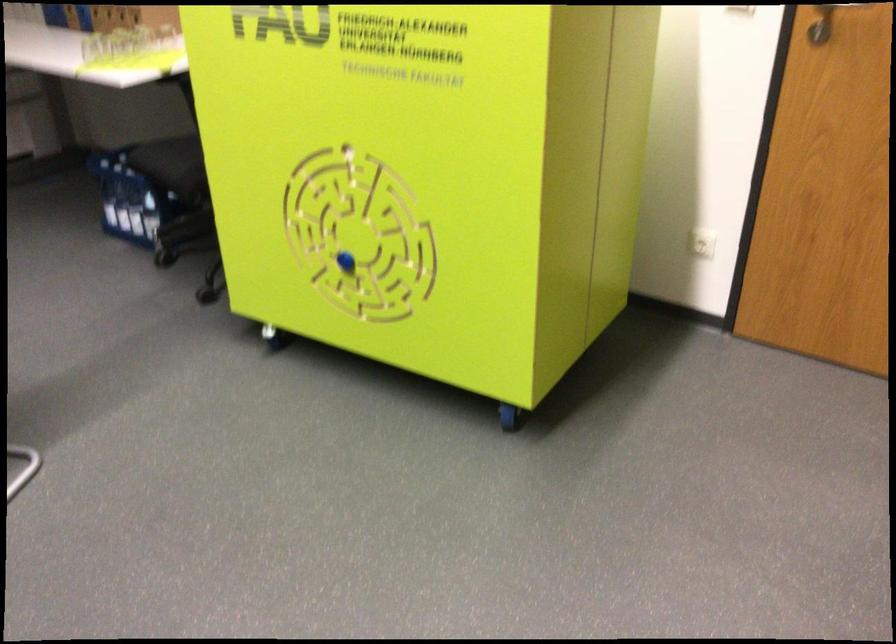
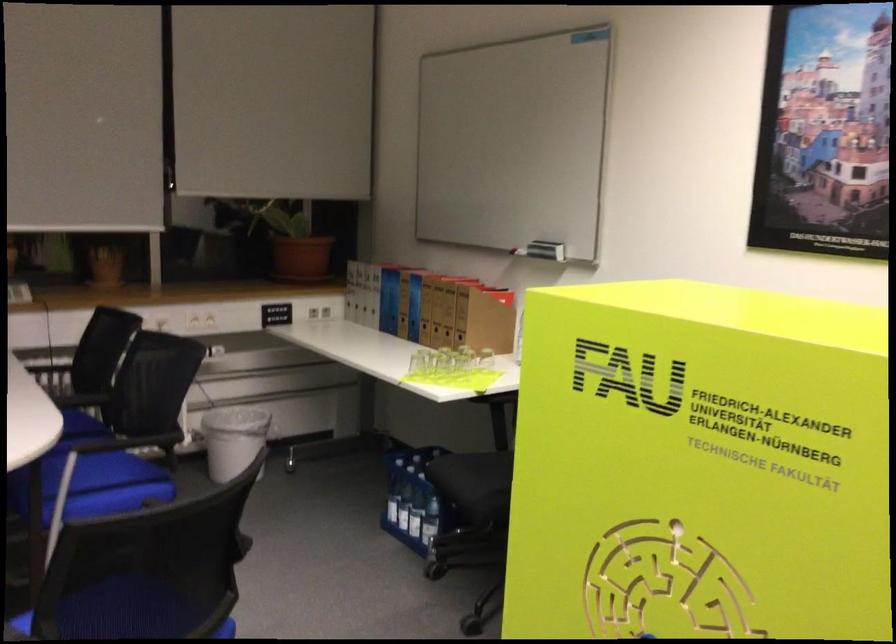
Find the pixel in the second image that matches point 113,203 in the first image.

(392, 500)